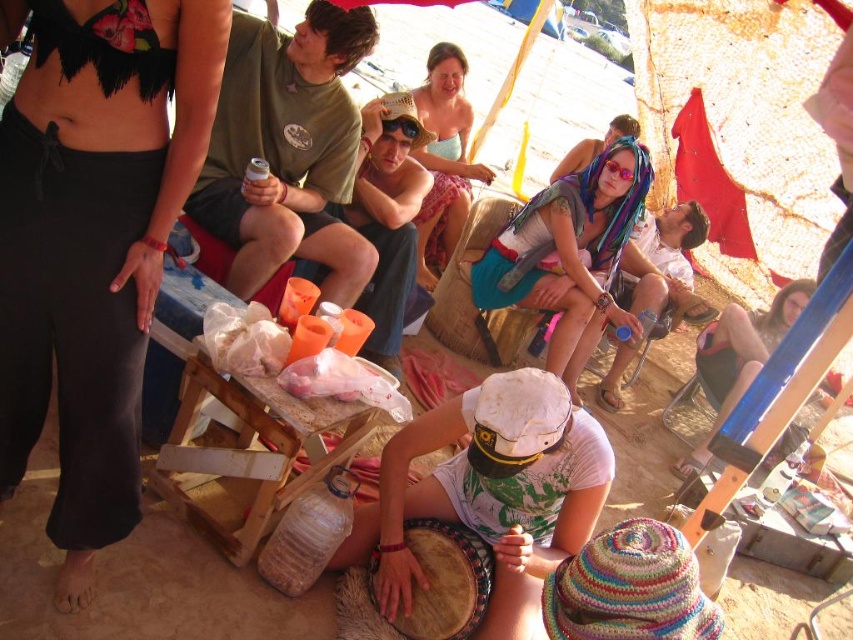
Which is more to the right, multicolored fabric scarf at center or light blue fabric dress at center?

From the viewer's perspective, multicolored fabric scarf at center appears more on the right side.

Can you confirm if multicolored fabric scarf at center is positioned to the left of light blue fabric dress at center?

No, multicolored fabric scarf at center is not to the left of light blue fabric dress at center.

I want to click on multicolored fabric scarf at center, so click(x=569, y=253).

At what (x,y) coordinates should I click in order to perform the action: click on multicolored fabric scarf at center. Please return your answer as a coordinate pair (x, y). Image resolution: width=853 pixels, height=640 pixels. Looking at the image, I should click on (569, 253).

Identify the location of black fabric bikini top at upper left. The width and height of the screenshot is (853, 640). (93, 243).

Measure the distance between black fabric bikini top at upper left and matte black sunglasses at upper right.

black fabric bikini top at upper left is 12.35 feet away from matte black sunglasses at upper right.

Is point (65, 566) closer to viewer compared to point (712, 435)?

Yes, point (65, 566) is in front of point (712, 435).

What are the coordinates of `black fabric bikini top at upper left` in the screenshot? It's located at (93, 243).

Can you confirm if black fabric bikini top at upper left is smaller than wooden stool at center?

Actually, black fabric bikini top at upper left might be larger than wooden stool at center.

Can you confirm if black fabric bikini top at upper left is shorter than wooden stool at center?

In fact, black fabric bikini top at upper left may be taller than wooden stool at center.

Identify the location of black fabric bikini top at upper left. This screenshot has width=853, height=640. (93, 243).